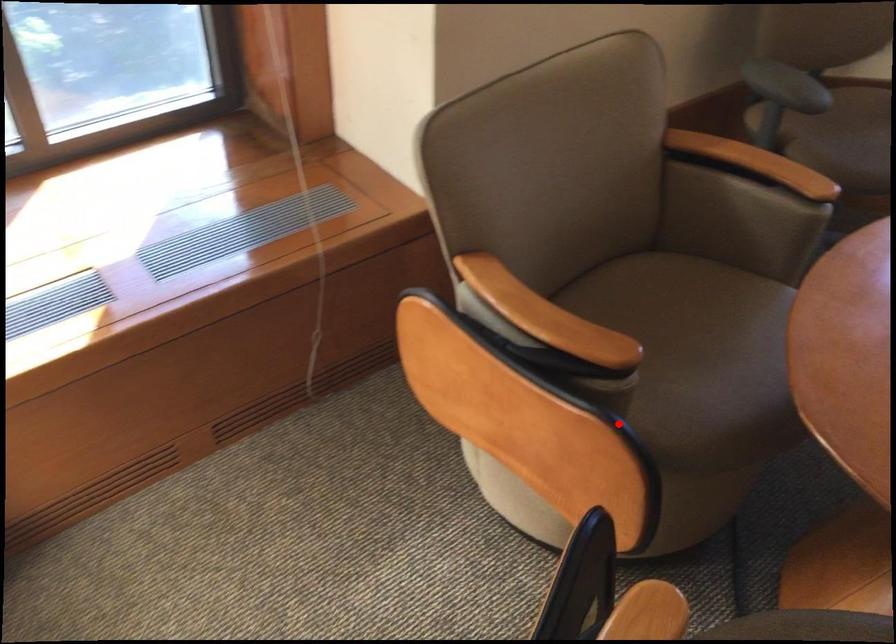
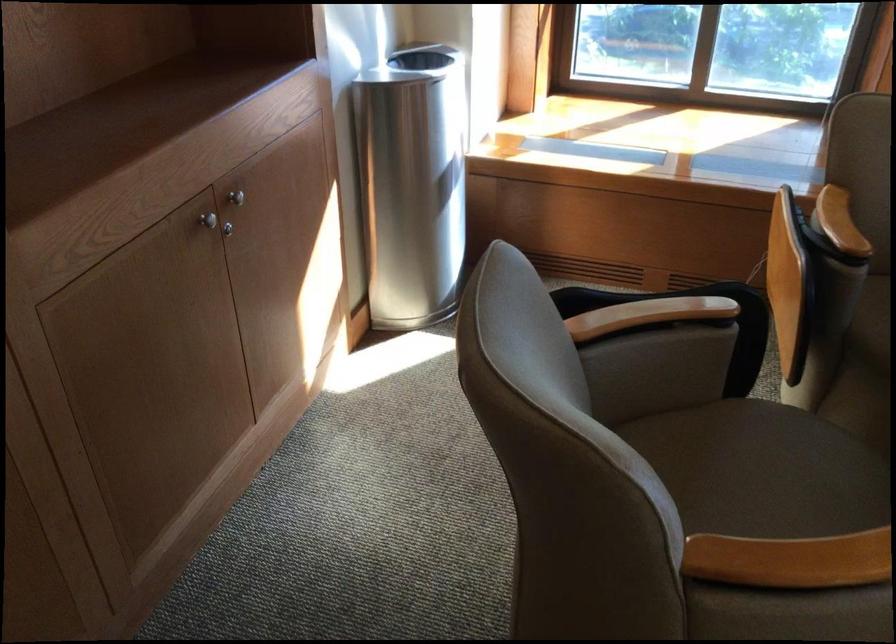
Question: I am providing you with two images of the same scene from different viewpoints. In image1, a red point is highlighted. Considering the same 3D point in image2, which of the following is correct?

Choices:
 (A) It is closer
 (B) It is farther

Answer: (B)